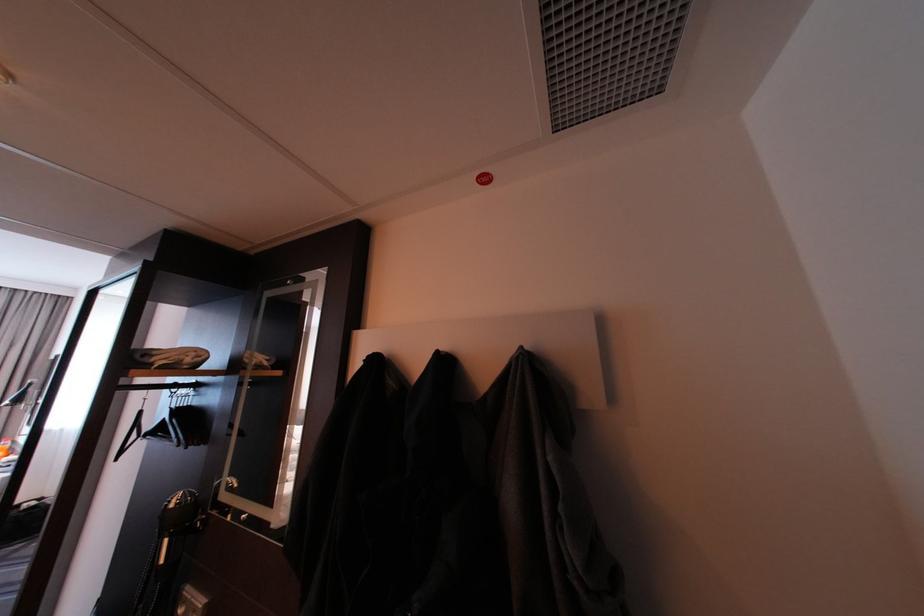
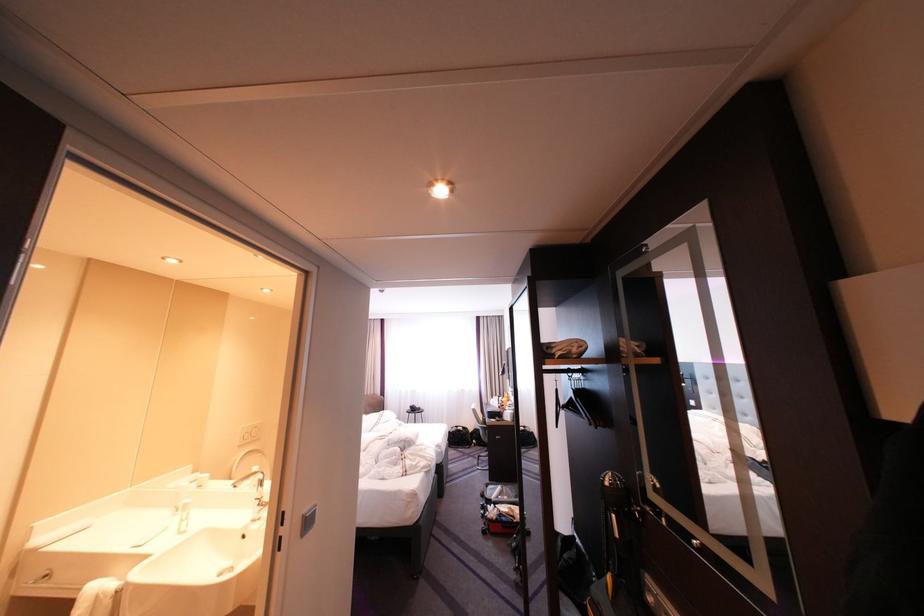
Find the pixel in the second image that matches (x=162, y=428) in the first image.

(576, 402)